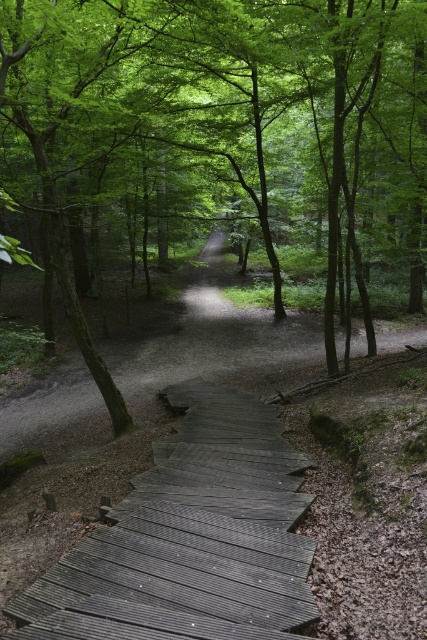
Is green leafy tree at center behind dark gray wooden stairs at bottom center?

Yes.

Looking at this image, is green leafy tree at center to the left of dark gray wooden stairs at bottom center from the viewer's perspective?

Indeed, green leafy tree at center is positioned on the left side of dark gray wooden stairs at bottom center.

Who is more distant from viewer, (146, 232) or (143, 515)?

Point (146, 232)

Where is `green leafy tree at center`? green leafy tree at center is located at coordinates (224, 132).